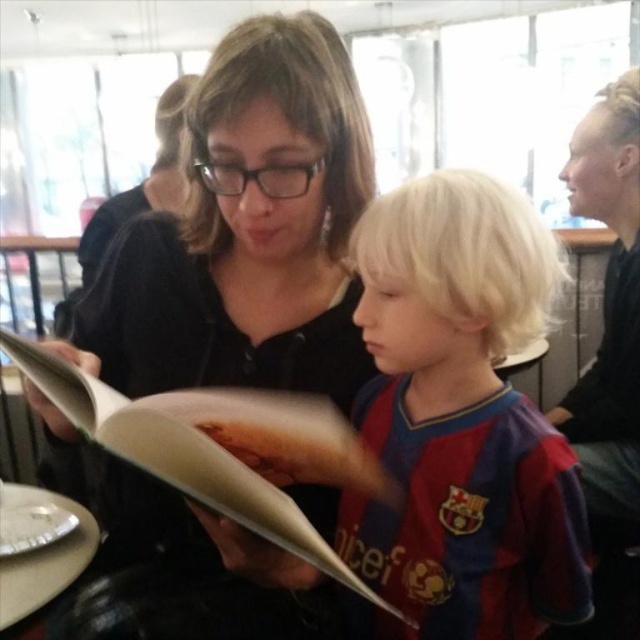
You are a photographer setting up a shot of the scene described. You want to ensure both the red striped jersey at center and the matte paper book at center are clearly visible. Which object should you adjust your focus to first if you need to prioritize the one that is further to the right?

The red striped jersey at center is positioned on the right side of matte paper book at center, so you should focus on the red striped jersey at center first since it is further to the right.

You are a photographer trying to capture a candid shot of the scene. You need to ensure that both the red striped jersey at center and the matte paper book at center are in focus. Given that your camera has a depth of field that can cover 15 centimeters, will you be able to get both objects in focus?

The distance between the red striped jersey at center and the matte paper book at center is 12.29 centimeters, which is within the camera lens depth of field of 15 centimeters. Therefore, both objects will be in focus.

You are a photographer trying to capture a closeup of the matte paper book at center without including the red striped jersey at center in the frame. Given their sizes, is this possible?

The red striped jersey at center is bigger than matte paper book at center, so it might be challenging to frame the matte paper book at center without including the jersey if they are positioned closely together.